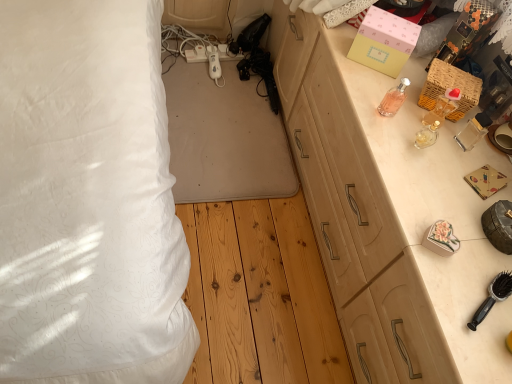
Question: Is woven wicker basket at upper right, which is the second box from left to right, in front of or behind pink glass bottle at upper right, the first perfume in the left-to-right sequence, in the image?

Choices:
 (A) behind
 (B) front

Answer: (A)

Question: Would you say woven wicker basket at upper right, which is the second box from left to right, is to the left or to the right of pink glass bottle at upper right, positioned as the 3th perfume in right-to-left order, in the picture?

Choices:
 (A) right
 (B) left

Answer: (A)

Question: Which object is the farthest from the clear glass perfume at upper right, the 1th perfume viewed from the right?

Choices:
 (A) translucent glass perfume at right, the 2th perfume viewed from the right
 (B) light wood cabinet at right
 (C) woven wicker basket at upper right, which is the second box from left to right
 (D) pink glass bottle at upper right, the first perfume in the left-to-right sequence
 (E) black plastic brush at lower right

Answer: (E)

Question: Which is nearer to the pink glass bottle at upper right, the first perfume in the left-to-right sequence?

Choices:
 (A) black plastic brush at lower right
 (B) translucent glass perfume at right, the 2th perfume viewed from the right
 (C) light wood cabinet at right
 (D) clear glass perfume at upper right, the 1th perfume viewed from the right
 (E) woven wicker basket at upper right, which is the second box from left to right

Answer: (B)